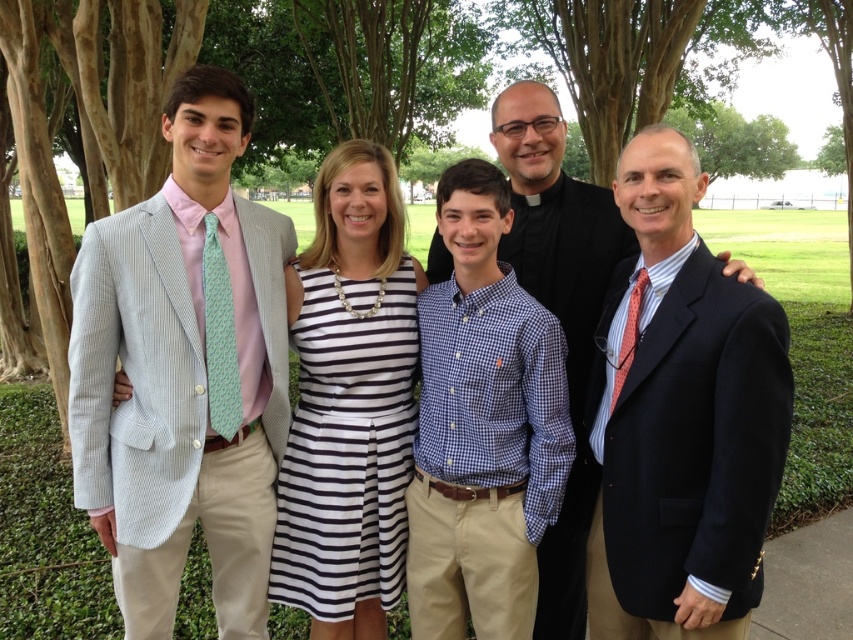
You are a photographer trying to capture a closeup of the blue checkered shirt at center and the black and white striped dress at center. The camera you are using has a maximum focus range of 12 inches. Can you fit both subjects into the frame without moving the camera?

The blue checkered shirt at center and black and white striped dress at center are 13.44 inches apart, which exceeds the camera maximum focus range of 12 inches. Therefore, you cannot fit both subjects into the frame without moving the camera.

You are standing in the park and see the light gray seersucker suit at left and the matte black suit at center. Which one is more to the left?

The light gray seersucker suit at left is more to the left.